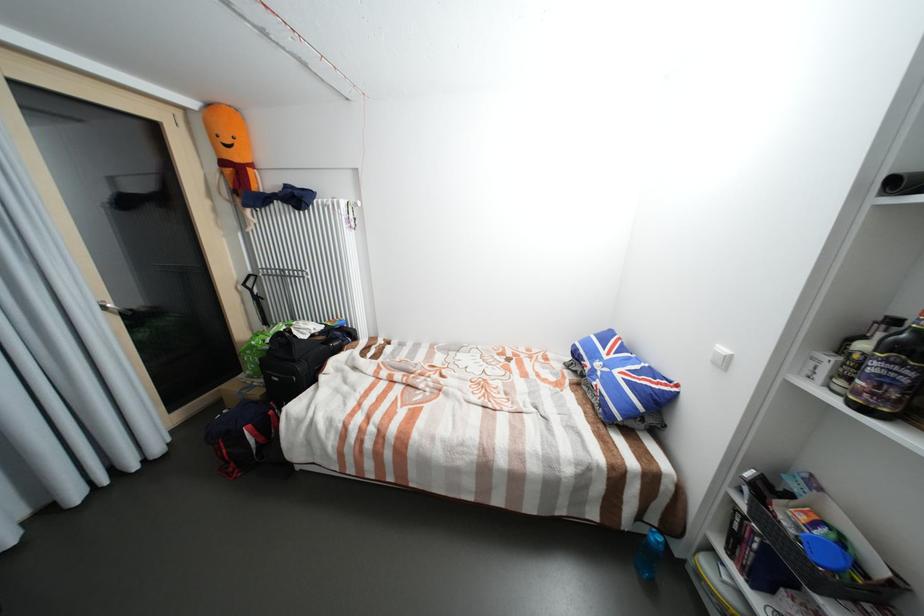
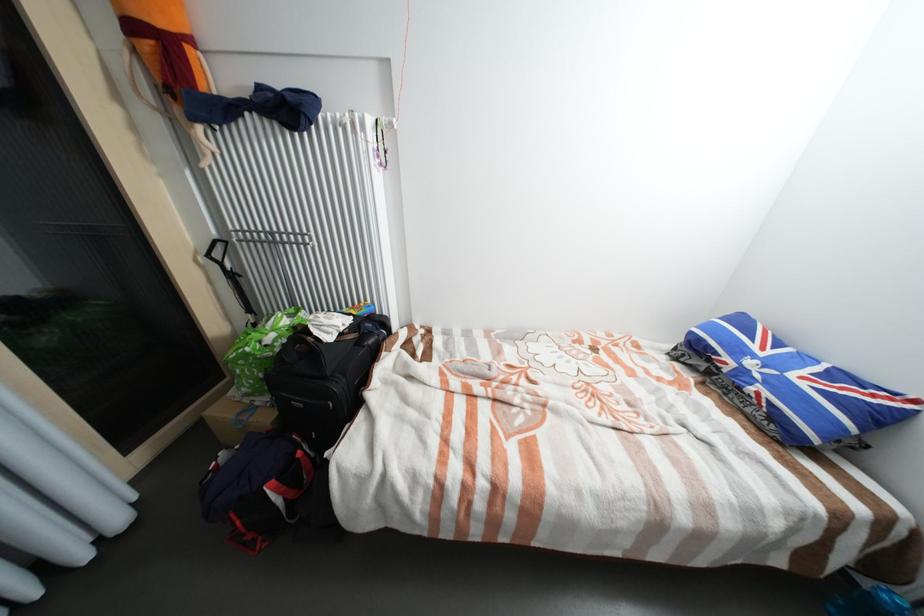
Find the pixel in the second image that matches (264,392) in the first image.

(273, 419)